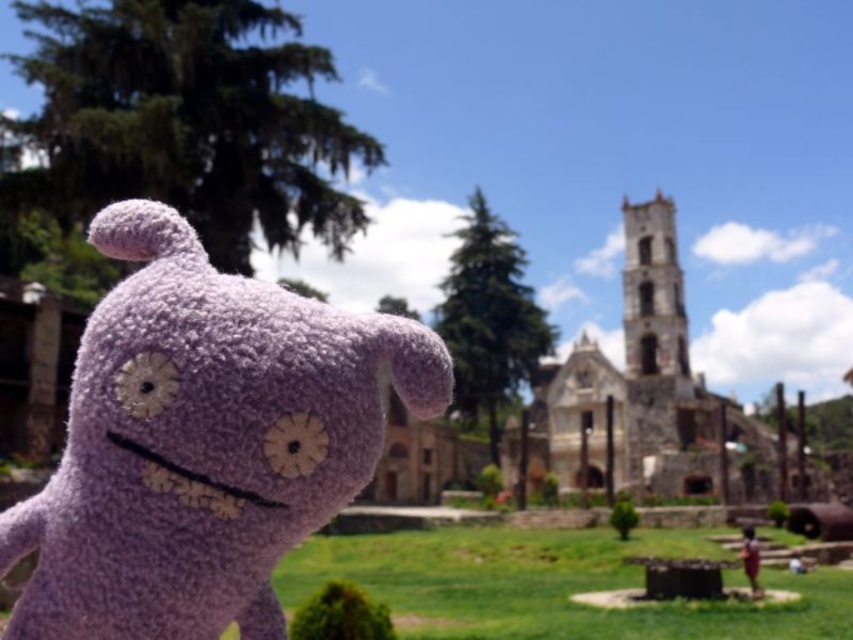
Is purple fuzzy toy at left positioned at the back of stone church at center?

That is False.

Does point (67, 504) come closer to viewer compared to point (653, 296)?

Yes, point (67, 504) is closer to viewer.

Between point (238, 280) and point (721, 454), which one is positioned in front?

Point (238, 280)

The image size is (853, 640). Identify the location of purple fuzzy toy at left. (202, 442).